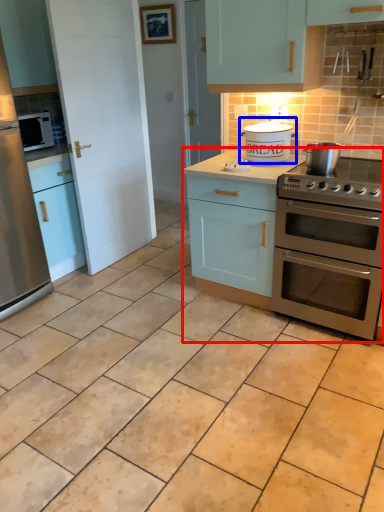
Question: Which point is closer to the camera, cabinetry (highlighted by a red box) or appliance (highlighted by a blue box)?

Choices:
 (A) cabinetry
 (B) appliance

Answer: (A)